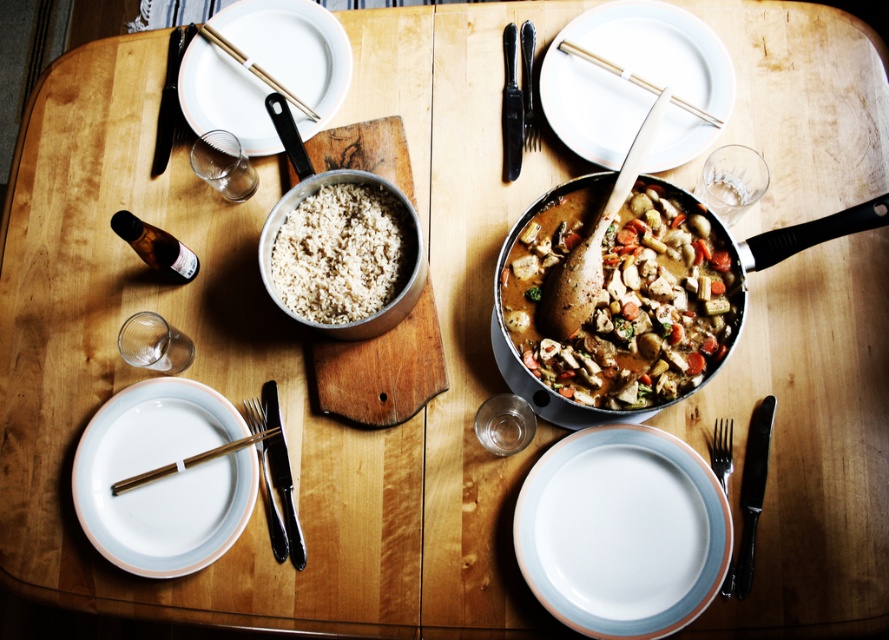
Is transparent glass at upper right smaller than transparent glass at lower left?

Actually, transparent glass at upper right might be larger than transparent glass at lower left.

Does point (719, 204) come farther from viewer compared to point (141, 317)?

No.

Where is `transparent glass at upper right`? transparent glass at upper right is located at coordinates (733, 180).

Between white glossy plate at lower left and white matte rice bowl at center, which one has more height?

With more height is white glossy plate at lower left.

Is white glossy plate at lower left below white matte rice bowl at center?

Yes, white glossy plate at lower left is below white matte rice bowl at center.

Between point (129, 410) and point (357, 189), which one is positioned in front?

Point (357, 189) is more forward.

You are a GUI agent. You are given a task and a screenshot of the screen. Output one action in this format:
    pyautogui.click(x=<x>, y=<y>)
    Task: Click on the white glossy plate at lower left
    
    Given the screenshot: What is the action you would take?
    pyautogui.click(x=163, y=477)

Does white glossy plate at lower center come in front of black metal fork at lower left?

Yes, it is.

Measure the distance between point (x=591, y=486) and camera.

Point (x=591, y=486) is 36.50 inches from camera.

Locate an element on the screen. This screenshot has width=889, height=640. white glossy plate at lower center is located at coordinates (622, 531).